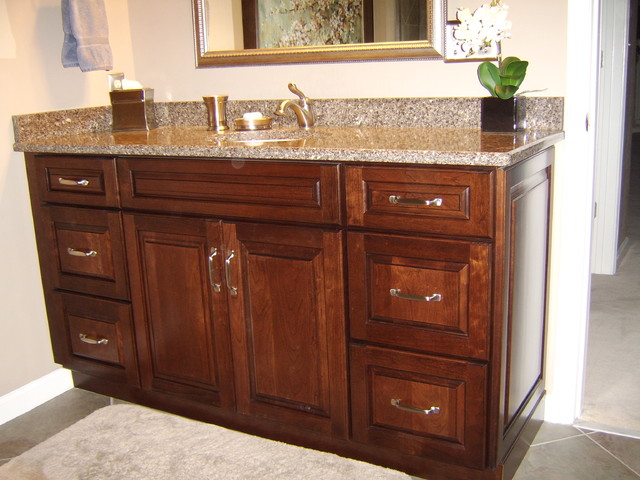
You are a GUI agent. You are given a task and a screenshot of the screen. Output one action in this format:
    pyautogui.click(x=<x>, y=<y>)
    Task: Click on the handles
    The width and height of the screenshot is (640, 480).
    Given the screenshot: What is the action you would take?
    pyautogui.click(x=422, y=203), pyautogui.click(x=413, y=292), pyautogui.click(x=402, y=409), pyautogui.click(x=228, y=267), pyautogui.click(x=214, y=270), pyautogui.click(x=68, y=180), pyautogui.click(x=82, y=252), pyautogui.click(x=91, y=338)